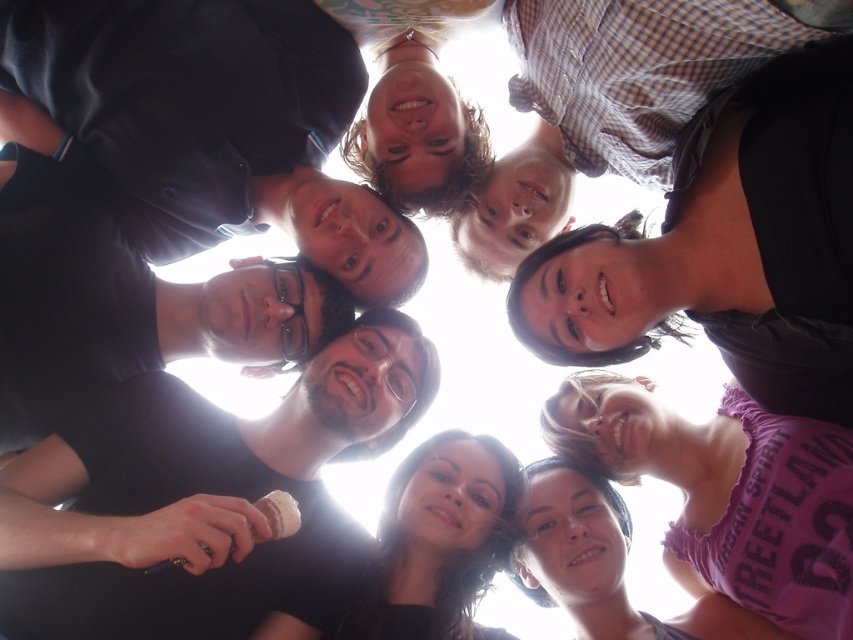
Which is below, black matte ice cream cone at center or checkered shirt at upper center?

black matte ice cream cone at center is lower down.

Where is `black matte ice cream cone at center`? The image size is (853, 640). black matte ice cream cone at center is located at coordinates (202, 499).

Does black matte ice cream cone at center appear under black matte shirt at upper left?

Yes, black matte ice cream cone at center is below black matte shirt at upper left.

Is black matte ice cream cone at center bigger than black matte shirt at upper left?

Indeed, black matte ice cream cone at center has a larger size compared to black matte shirt at upper left.

Identify the location of black matte ice cream cone at center. (202, 499).

This screenshot has width=853, height=640. What do you see at coordinates (213, 125) in the screenshot?
I see `black matte shirt at upper left` at bounding box center [213, 125].

Who is more distant from viewer, (62, 77) or (556, 195)?

Positioned behind is point (556, 195).

Where is `black matte shirt at upper left`? The height and width of the screenshot is (640, 853). black matte shirt at upper left is located at coordinates (213, 125).